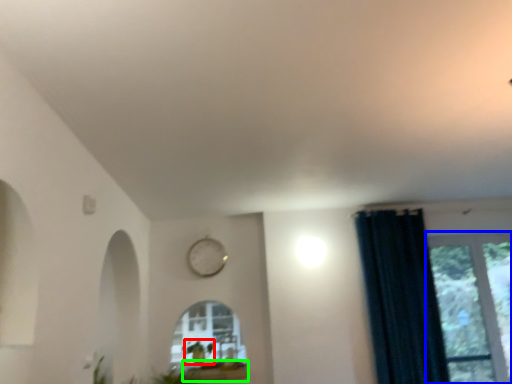
Question: Which object is positioned farthest from plant (highlighted by a red box)? Select from window (highlighted by a blue box) and window sill (highlighted by a green box).

Choices:
 (A) window
 (B) window sill

Answer: (A)